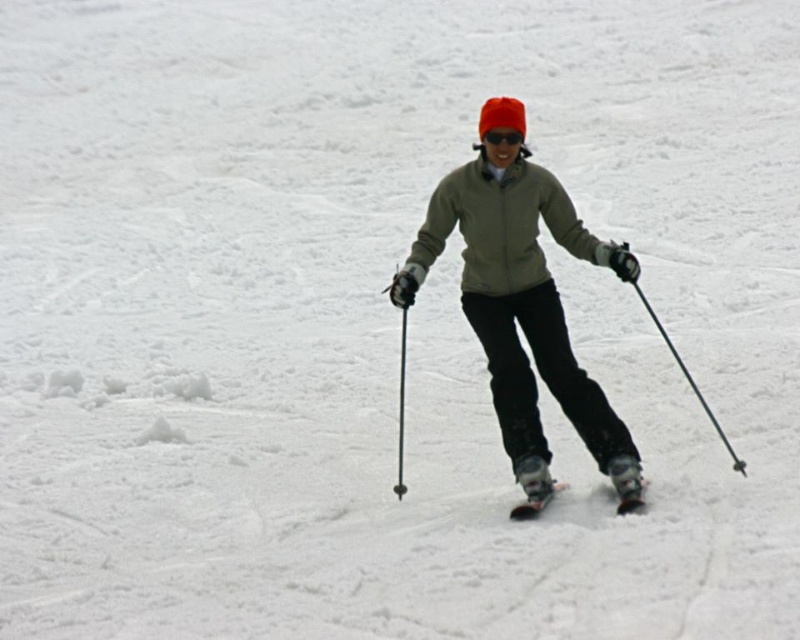
Is shiny metallic skis at center taller than transparent plastic goggles at center?

Yes, shiny metallic skis at center is taller than transparent plastic goggles at center.

Can you confirm if shiny metallic skis at center is bigger than transparent plastic goggles at center?

Correct, shiny metallic skis at center is larger in size than transparent plastic goggles at center.

Who is more distant from viewer, (x=529, y=500) or (x=508, y=128)?

Point (x=508, y=128)

Where is `shiny metallic skis at center`? Image resolution: width=800 pixels, height=640 pixels. shiny metallic skis at center is located at coordinates (536, 500).

Does matte green jacket at center have a greater height compared to shiny metallic skis at center?

Indeed, matte green jacket at center has a greater height compared to shiny metallic skis at center.

You are a GUI agent. You are given a task and a screenshot of the screen. Output one action in this format:
    pyautogui.click(x=<x>, y=<y>)
    Task: Click on the matte green jacket at center
    The height and width of the screenshot is (640, 800).
    Given the screenshot: What is the action you would take?
    pyautogui.click(x=522, y=301)

Does point (494, 237) come in front of point (538, 506)?

No.

At what (x,y) coordinates should I click in order to perform the action: click on matte green jacket at center. Please return your answer as a coordinate pair (x, y). Image resolution: width=800 pixels, height=640 pixels. Looking at the image, I should click on (522, 301).

Between matte green jacket at center and shiny metallic ski at center, which one has less height?

shiny metallic ski at center

Is point (622, 262) more distant than point (544, 506)?

No, it is in front of (544, 506).

Identify the location of matte green jacket at center. The width and height of the screenshot is (800, 640). (522, 301).

In order to click on matte green jacket at center in this screenshot , I will do `click(522, 301)`.